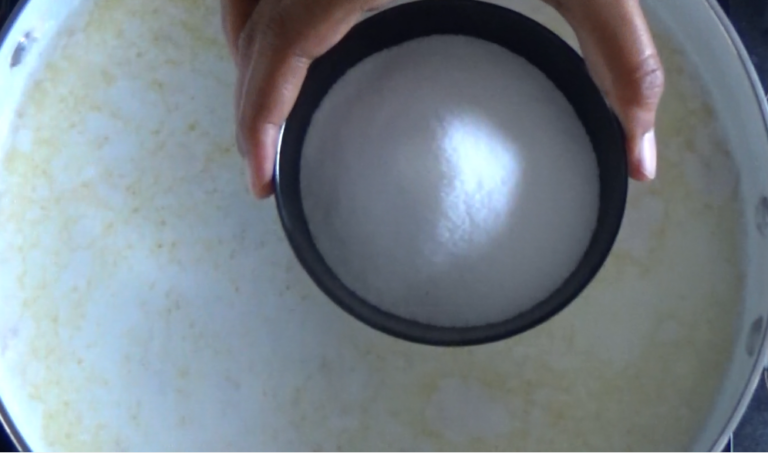
This screenshot has width=768, height=453. Find the location of `place to cook food`. place to cook food is located at coordinates (204, 253).